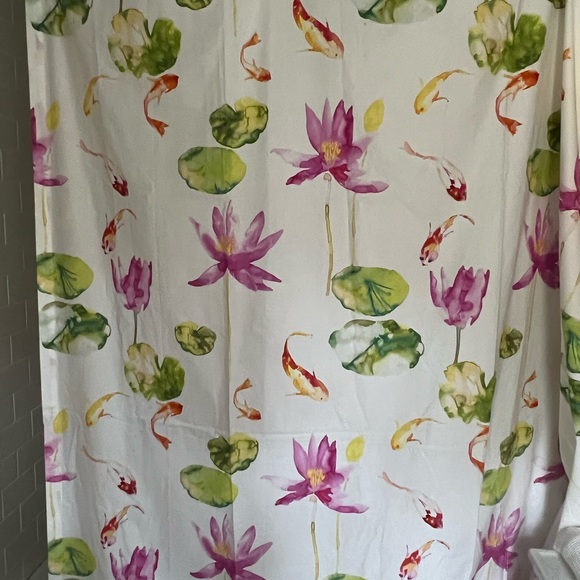
Identify the location of shower curtain. (405, 499).